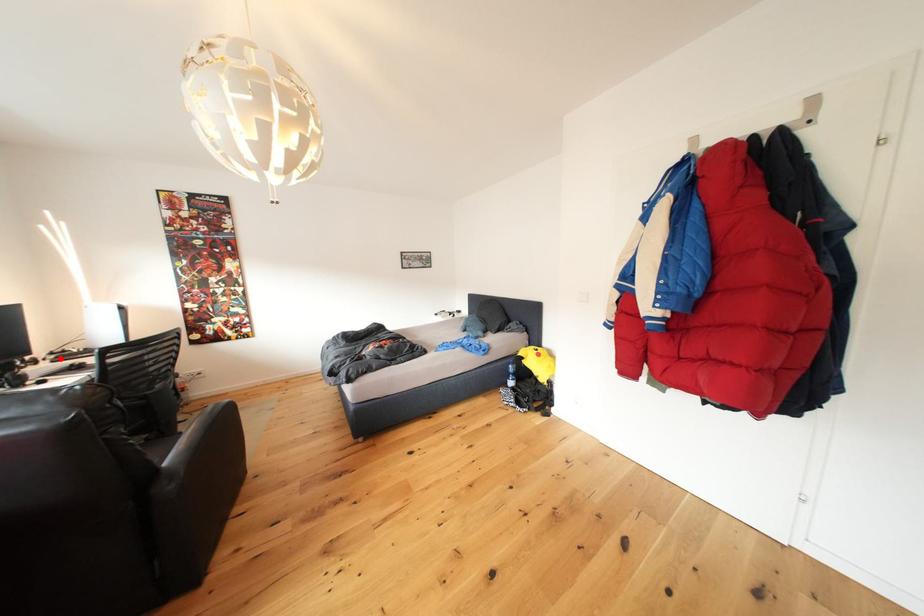
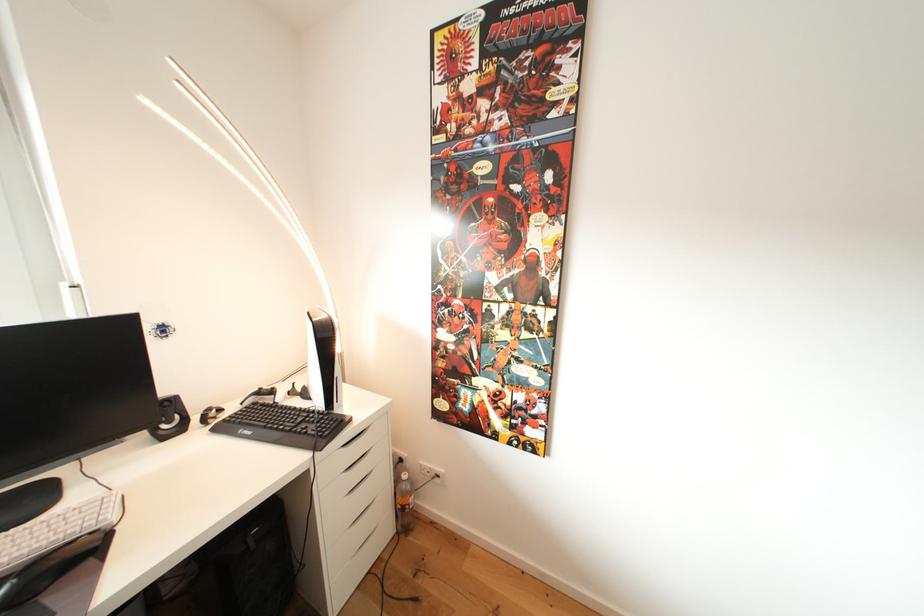
Locate, in the second image, the point that corresponds to the highlighted location in the first image.

(268, 398)